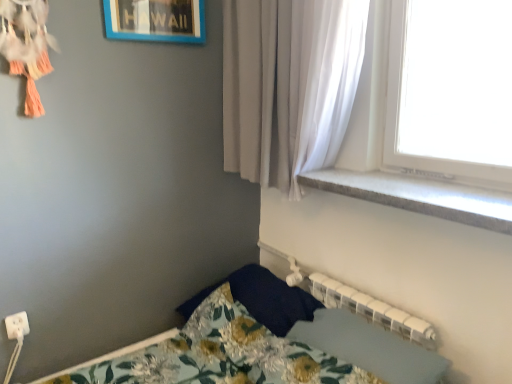
Question: Is the depth of gray concrete window sill at upper right less than that of white sheer curtain at upper right?

Choices:
 (A) no
 (B) yes

Answer: (B)

Question: Does gray concrete window sill at upper right have a lesser height compared to white sheer curtain at upper right?

Choices:
 (A) no
 (B) yes

Answer: (B)

Question: Is gray concrete window sill at upper right wider than white sheer curtain at upper right?

Choices:
 (A) no
 (B) yes

Answer: (A)

Question: Does gray concrete window sill at upper right turn towards white sheer curtain at upper right?

Choices:
 (A) no
 (B) yes

Answer: (A)

Question: Is gray concrete window sill at upper right positioned with its back to white sheer curtain at upper right?

Choices:
 (A) yes
 (B) no

Answer: (B)

Question: Is gray concrete window sill at upper right not within white sheer curtain at upper right?

Choices:
 (A) yes
 (B) no

Answer: (A)

Question: Does floral fabric bedsheet at lower center have a greater width compared to blue plastic picture frame at upper center?

Choices:
 (A) yes
 (B) no

Answer: (A)

Question: Would you say floral fabric bedsheet at lower center is outside blue plastic picture frame at upper center?

Choices:
 (A) no
 (B) yes

Answer: (B)

Question: Does floral fabric bedsheet at lower center have a smaller size compared to blue plastic picture frame at upper center?

Choices:
 (A) no
 (B) yes

Answer: (A)

Question: Is floral fabric bedsheet at lower center taller than blue plastic picture frame at upper center?

Choices:
 (A) yes
 (B) no

Answer: (A)

Question: From the image's perspective, is floral fabric bedsheet at lower center below blue plastic picture frame at upper center?

Choices:
 (A) yes
 (B) no

Answer: (A)

Question: Is floral fabric bedsheet at lower center thinner than blue plastic picture frame at upper center?

Choices:
 (A) no
 (B) yes

Answer: (A)

Question: Is gray concrete window sill at upper right further to camera compared to floral fabric bedsheet at lower center?

Choices:
 (A) no
 (B) yes

Answer: (A)